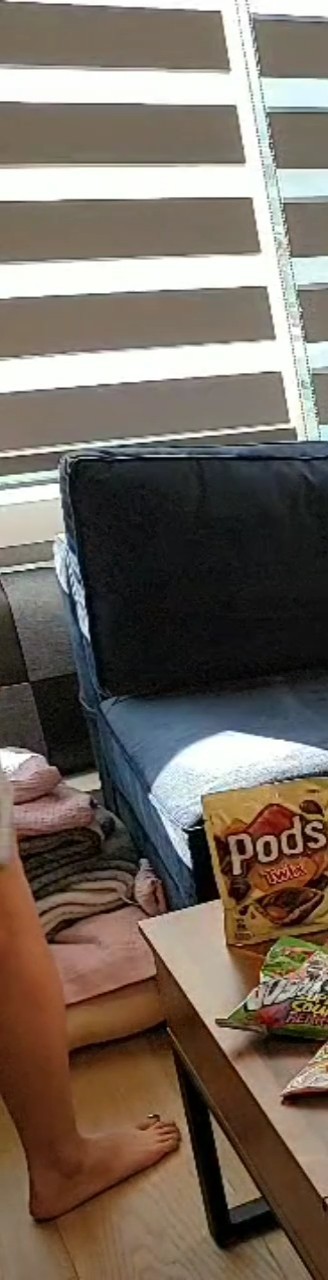
Where is `green blanket`? The width and height of the screenshot is (328, 1280). green blanket is located at coordinates (82, 855).